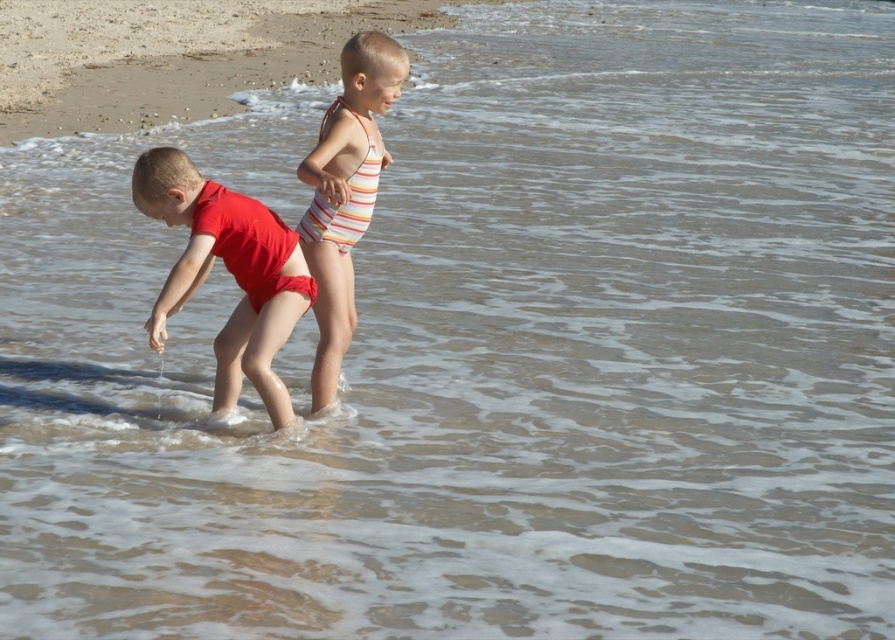
Which is more to the right, matte red swimsuit at left or striped fabric swimsuit at center?

striped fabric swimsuit at center

Which is in front, point (232, 196) or point (325, 296)?

Positioned in front is point (232, 196).

The width and height of the screenshot is (895, 640). Identify the location of matte red swimsuit at left. (228, 269).